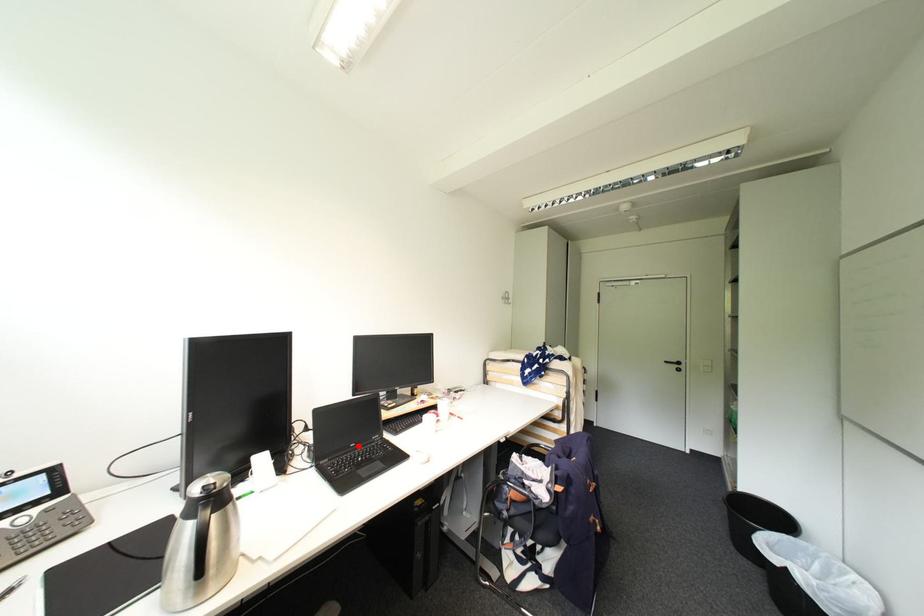
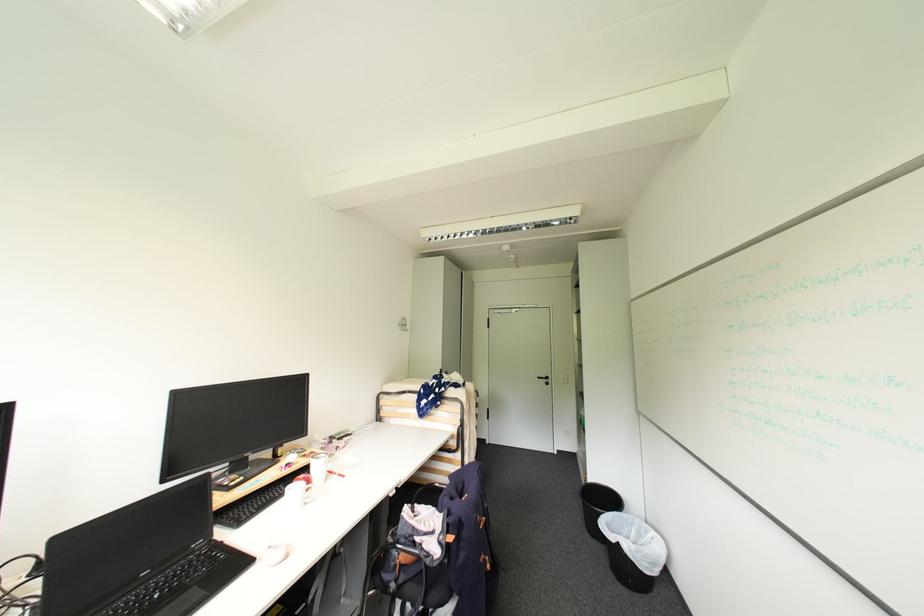
Question: I am providing you with two images of the same scene from different viewpoints. A red point is shown in image1. For the corresponding object point in image2, is it positioned nearer or farther from the camera?

Choices:
 (A) Nearer
 (B) Farther

Answer: (A)